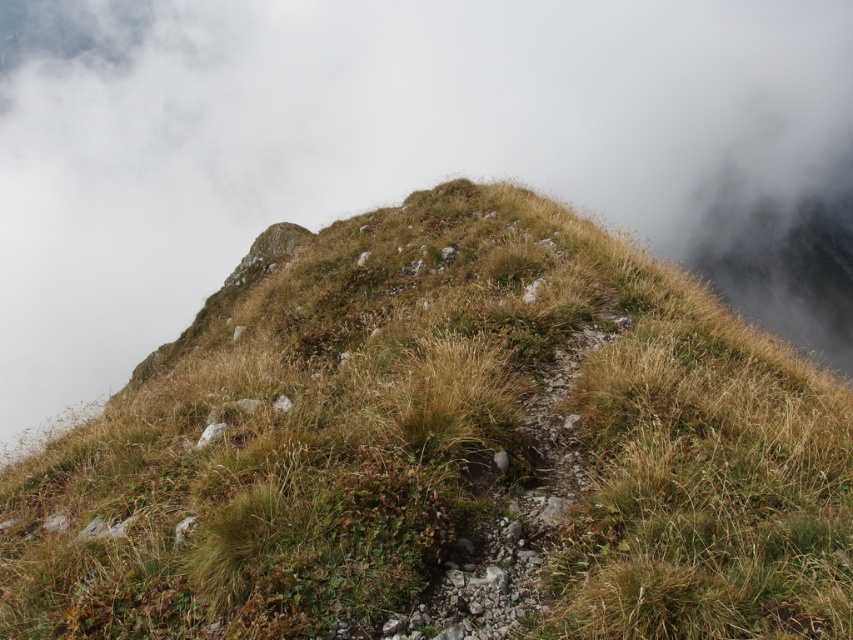
Question: Which object is closer to the camera taking this photo?

Choices:
 (A) white fluffy cloud at upper center
 (B) green grassy at center

Answer: (B)

Question: Is green grassy at center wider than white fluffy cloud at upper center?

Choices:
 (A) yes
 (B) no

Answer: (B)

Question: Does green grassy at center come behind white fluffy cloud at upper center?

Choices:
 (A) yes
 (B) no

Answer: (B)

Question: In this image, where is green grassy at center located relative to white fluffy cloud at upper center?

Choices:
 (A) above
 (B) below

Answer: (B)